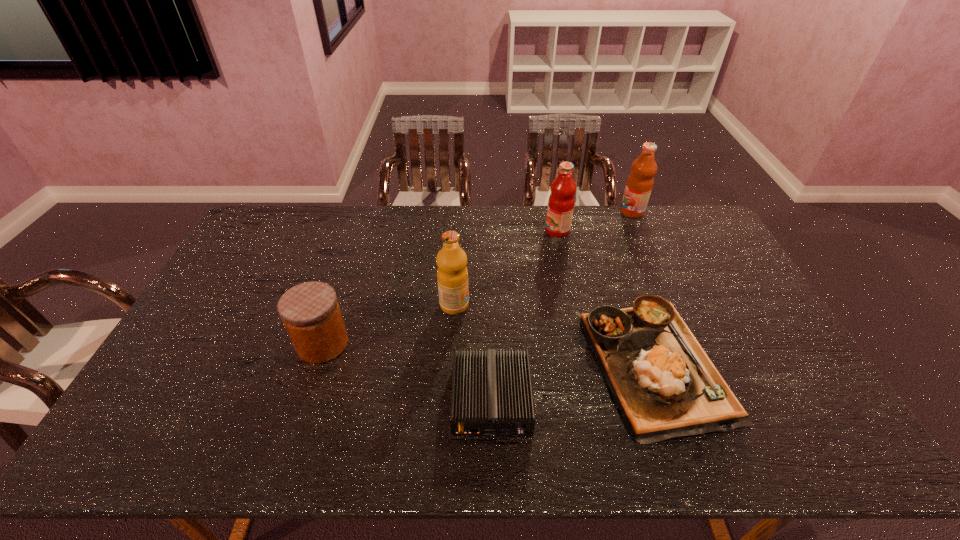
Find the location of a particular element. The width and height of the screenshot is (960, 540). the farthest object is located at coordinates (639, 184).

This screenshot has width=960, height=540. Identify the location of the farthest fruit juice. (639, 184).

Where is `the second farthest fruit juice`? This screenshot has width=960, height=540. the second farthest fruit juice is located at coordinates [561, 202].

Identify the location of the second fruit juice from left to right. This screenshot has width=960, height=540. (561, 202).

This screenshot has height=540, width=960. I want to click on the nearest fruit juice, so click(452, 275).

The height and width of the screenshot is (540, 960). Find the location of `jar`. jar is located at coordinates (310, 312).

Locate an element on the screen. The height and width of the screenshot is (540, 960). the third shortest object is located at coordinates (310, 312).

The height and width of the screenshot is (540, 960). Identify the location of platter. (665, 385).

In order to click on router in this screenshot , I will do `click(492, 394)`.

At what (x,y) coordinates should I click in order to perform the action: click on blank space located 0.050m on the front label of the farthest object. Please return your answer as a coordinate pair (x, y). The height and width of the screenshot is (540, 960). Looking at the image, I should click on (607, 212).